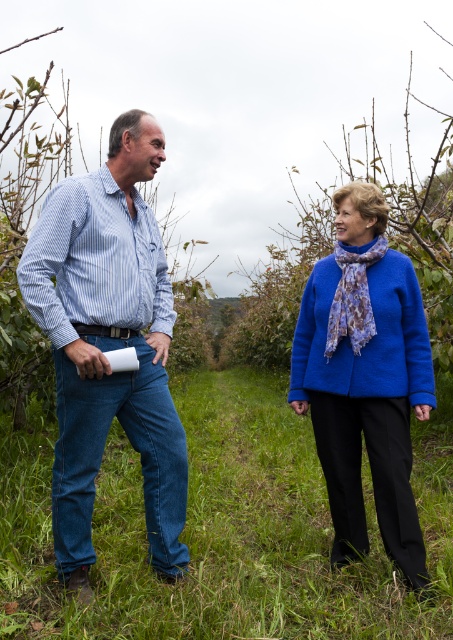
Looking at this image, you are a fashion designer observing two items in the scene. The blue woolen sweater at center and the lavender floral scarf at center. Which item is taller?

The blue woolen sweater at center is much taller than the lavender floral scarf at center.

You are planning to lay out a picnic blanket in the rural setting shown. The picnic blanket is 2 meters wide. You see the green grass at center and the blue woolen sweater at center. Which area would be suitable for placing the blanket based on their widths?

The blue woolen sweater at center has a greater width than the green grass at center. Since the picnic blanket is 2 meters wide, the blue woolen sweater at center would provide a wider area suitable for placing the blanket.